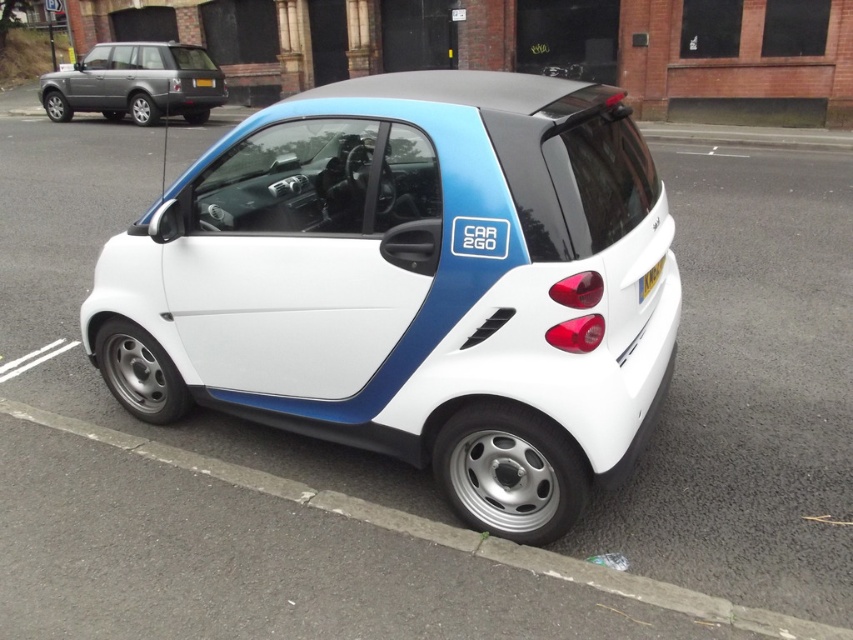
Does point (497, 544) come farther from viewer compared to point (76, 74)?

That is False.

Is gray asphalt curb at lower center positioned at the back of silver metallic suv at upper left?

No, gray asphalt curb at lower center is in front of silver metallic suv at upper left.

Locate an element on the screen. The width and height of the screenshot is (853, 640). gray asphalt curb at lower center is located at coordinates (444, 532).

Can you confirm if white matte car at center is shorter than silver metallic suv at upper left?

In fact, white matte car at center may be taller than silver metallic suv at upper left.

Looking at this image, who is more distant from viewer, (248, 310) or (154, 54)?

Point (154, 54)

Find the location of `white matte car at center`. white matte car at center is located at coordinates (412, 285).

Is the position of silver metallic suv at upper left more distant than that of yellow plastic license plate at rear?

Yes.

Is silver metallic suv at upper left shorter than yellow plastic license plate at rear?

In fact, silver metallic suv at upper left may be taller than yellow plastic license plate at rear.

The image size is (853, 640). What do you see at coordinates (136, 83) in the screenshot?
I see `silver metallic suv at upper left` at bounding box center [136, 83].

Image resolution: width=853 pixels, height=640 pixels. I want to click on silver metallic suv at upper left, so click(x=136, y=83).